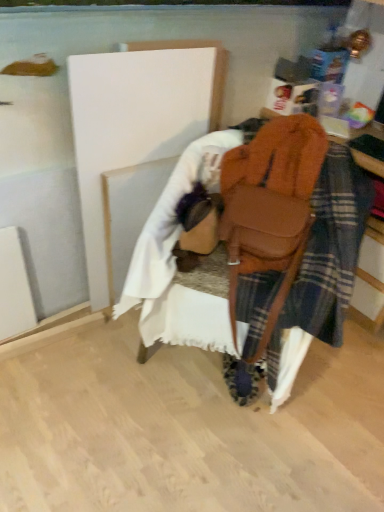
What do you see at coordinates (129, 213) in the screenshot? I see `white fabric at lower center, which appears as the first wood when ordered from the bottom` at bounding box center [129, 213].

How much space does white painted wood at center, acting as the second wood starting from the bottom, occupy horizontally?

white painted wood at center, acting as the second wood starting from the bottom, is 4.55 inches wide.

At what (x,y) coordinates should I click in order to perform the action: click on white fabric at lower center, which appears as the first wood when ordered from the bottom. Please return your answer as a coordinate pair (x, y). Looking at the image, I should click on (129, 213).

In terms of width, does white fabric at lower center, marked as the second wood in a top-to-bottom arrangement, look wider or thinner when compared to brown leather bag at center?

Clearly, white fabric at lower center, marked as the second wood in a top-to-bottom arrangement, has less width compared to brown leather bag at center.

Is point (134, 226) closer or farther from the camera than point (231, 325)?

Point (134, 226) is positioned farther from the camera compared to point (231, 325).

Is white fabric at lower center, which appears as the first wood when ordered from the bottom, shorter than brown leather bag at center?

No.

Considering the relative positions of white fabric at lower center, which appears as the first wood when ordered from the bottom, and brown leather bag at center in the image provided, is white fabric at lower center, which appears as the first wood when ordered from the bottom, in front of brown leather bag at center?

No, white fabric at lower center, which appears as the first wood when ordered from the bottom, is further to the viewer.

Does white painted wood at center, positioned as the first wood in top-to-bottom order, have a larger size compared to white fabric at lower center, which appears as the first wood when ordered from the bottom?

Yes, white painted wood at center, positioned as the first wood in top-to-bottom order, is bigger than white fabric at lower center, which appears as the first wood when ordered from the bottom.

Considering the sizes of white painted wood at center, acting as the second wood starting from the bottom, and white fabric at lower center, which appears as the first wood when ordered from the bottom, in the image, is white painted wood at center, acting as the second wood starting from the bottom, wider or thinner than white fabric at lower center, which appears as the first wood when ordered from the bottom,?

white painted wood at center, acting as the second wood starting from the bottom, is wider than white fabric at lower center, which appears as the first wood when ordered from the bottom.

Between white painted wood at center, acting as the second wood starting from the bottom, and white fabric at lower center, which appears as the first wood when ordered from the bottom, which one has less height?

Standing shorter between the two is white fabric at lower center, which appears as the first wood when ordered from the bottom.

Is white painted wood at center, positioned as the first wood in top-to-bottom order, completely or partially outside of white fabric at lower center, marked as the second wood in a top-to-bottom arrangement?

That's correct, white painted wood at center, positioned as the first wood in top-to-bottom order, is outside of white fabric at lower center, marked as the second wood in a top-to-bottom arrangement.

You are a GUI agent. You are given a task and a screenshot of the screen. Output one action in this format:
    pyautogui.click(x=<x>, y=<y>)
    Task: Click on the wood lying below the white painted wood at center, positioned as the first wood in top-to-bottom order (from the image's perspective)
    This screenshot has height=512, width=384.
    Given the screenshot: What is the action you would take?
    pyautogui.click(x=129, y=213)

Is white painted wood at center, acting as the second wood starting from the bottom, completely or partially inside white fabric at lower center, marked as the second wood in a top-to-bottom arrangement?

No, white fabric at lower center, marked as the second wood in a top-to-bottom arrangement, does not contain white painted wood at center, acting as the second wood starting from the bottom.

Considering the relative sizes of white fabric at lower center, marked as the second wood in a top-to-bottom arrangement, and white painted wood at center, positioned as the first wood in top-to-bottom order, in the image provided, is white fabric at lower center, marked as the second wood in a top-to-bottom arrangement, shorter than white painted wood at center, positioned as the first wood in top-to-bottom order,?

Indeed, white fabric at lower center, marked as the second wood in a top-to-bottom arrangement, has a lesser height compared to white painted wood at center, positioned as the first wood in top-to-bottom order.

Considering the relative sizes of white fabric at lower center, marked as the second wood in a top-to-bottom arrangement, and white painted wood at center, positioned as the first wood in top-to-bottom order, in the image provided, is white fabric at lower center, marked as the second wood in a top-to-bottom arrangement, bigger than white painted wood at center, positioned as the first wood in top-to-bottom order,?

Incorrect, white fabric at lower center, marked as the second wood in a top-to-bottom arrangement, is not larger than white painted wood at center, positioned as the first wood in top-to-bottom order.

Based on their positions, is brown leather bag at center located to the left or right of white fabric at lower center, which appears as the first wood when ordered from the bottom?

From the image, it's evident that brown leather bag at center is to the right of white fabric at lower center, which appears as the first wood when ordered from the bottom.

What's the angular difference between brown leather bag at center and white fabric at lower center, which appears as the first wood when ordered from the bottom,'s facing directions?

The facing directions of brown leather bag at center and white fabric at lower center, which appears as the first wood when ordered from the bottom, are 72.2 degrees apart.

Is brown leather bag at center smaller than white fabric at lower center, marked as the second wood in a top-to-bottom arrangement?

Actually, brown leather bag at center might be larger than white fabric at lower center, marked as the second wood in a top-to-bottom arrangement.

Considering the relative sizes of brown leather bag at center and white fabric at lower center, which appears as the first wood when ordered from the bottom, in the image provided, is brown leather bag at center taller than white fabric at lower center, which appears as the first wood when ordered from the bottom,?

In fact, brown leather bag at center may be shorter than white fabric at lower center, which appears as the first wood when ordered from the bottom.

From the brown leather bag at center, count 1st woods backward and point to it. Please provide its 2D coordinates.

[(137, 122)]

Is the surface of brown leather bag at center in direct contact with white painted wood at center, positioned as the first wood in top-to-bottom order?

No.

Is white painted wood at center, acting as the second wood starting from the bottom, surrounded by brown leather bag at center?

No, brown leather bag at center does not contain white painted wood at center, acting as the second wood starting from the bottom.

Considering the relative sizes of brown leather bag at center and white painted wood at center, acting as the second wood starting from the bottom, in the image provided, is brown leather bag at center bigger than white painted wood at center, acting as the second wood starting from the bottom,?

Actually, brown leather bag at center might be smaller than white painted wood at center, acting as the second wood starting from the bottom.

Does white painted wood at center, acting as the second wood starting from the bottom, have a lesser height compared to brown leather bag at center?

No.

Can you tell me how much white painted wood at center, positioned as the first wood in top-to-bottom order, and brown leather bag at center differ in facing direction?

The angle between the facing direction of white painted wood at center, positioned as the first wood in top-to-bottom order, and the facing direction of brown leather bag at center is 71.4 degrees.

Is white painted wood at center, acting as the second wood starting from the bottom, spatially inside brown leather bag at center, or outside of it?

white painted wood at center, acting as the second wood starting from the bottom, is spatially situated outside brown leather bag at center.

Is the position of white painted wood at center, acting as the second wood starting from the bottom, less distant than that of brown leather bag at center?

No, white painted wood at center, acting as the second wood starting from the bottom, is further to the viewer.

This screenshot has width=384, height=512. Find the location of `furniture above the white fabric at lower center, marked as the second wood in a top-to-bottom arrangement (from a real-world perspective)`. furniture above the white fabric at lower center, marked as the second wood in a top-to-bottom arrangement (from a real-world perspective) is located at coordinates (270, 207).

Image resolution: width=384 pixels, height=512 pixels. I want to click on wood that appears on the right of white fabric at lower center, marked as the second wood in a top-to-bottom arrangement, so click(137, 122).

Estimate the real-world distances between objects in this image. Which object is further from white painted wood at center, acting as the second wood starting from the bottom, brown leather bag at center or white fabric at lower center, marked as the second wood in a top-to-bottom arrangement?

brown leather bag at center.

From the image, which object appears to be nearer to white fabric at lower center, marked as the second wood in a top-to-bottom arrangement, white painted wood at center, positioned as the first wood in top-to-bottom order, or brown leather bag at center?

Among the two, white painted wood at center, positioned as the first wood in top-to-bottom order, is located nearer to white fabric at lower center, marked as the second wood in a top-to-bottom arrangement.

Which object lies further to the anchor point brown leather bag at center, white fabric at lower center, marked as the second wood in a top-to-bottom arrangement, or white painted wood at center, positioned as the first wood in top-to-bottom order?

white fabric at lower center, marked as the second wood in a top-to-bottom arrangement.

Estimate the real-world distances between objects in this image. Which object is closer to brown leather bag at center, white painted wood at center, positioned as the first wood in top-to-bottom order, or white fabric at lower center, marked as the second wood in a top-to-bottom arrangement?

A: white painted wood at center, positioned as the first wood in top-to-bottom order.

Which object lies nearer to the anchor point white painted wood at center, acting as the second wood starting from the bottom, white fabric at lower center, which appears as the first wood when ordered from the bottom, or brown leather bag at center?

The object closer to white painted wood at center, acting as the second wood starting from the bottom, is white fabric at lower center, which appears as the first wood when ordered from the bottom.

Which object lies nearer to the anchor point white fabric at lower center, marked as the second wood in a top-to-bottom arrangement, brown leather bag at center or white painted wood at center, acting as the second wood starting from the bottom?

white painted wood at center, acting as the second wood starting from the bottom, lies closer to white fabric at lower center, marked as the second wood in a top-to-bottom arrangement, than the other object.

You are a GUI agent. You are given a task and a screenshot of the screen. Output one action in this format:
    pyautogui.click(x=<x>, y=<y>)
    Task: Click on the wood situated between white fabric at lower center, which appears as the first wood when ordered from the bottom, and brown leather bag at center from left to right
    Image resolution: width=384 pixels, height=512 pixels.
    Given the screenshot: What is the action you would take?
    pyautogui.click(x=137, y=122)